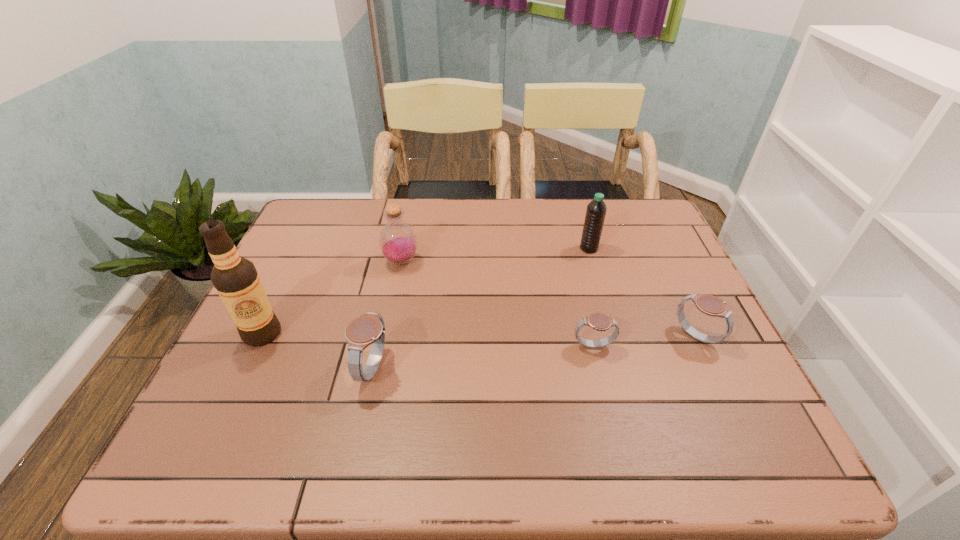
The width and height of the screenshot is (960, 540). In order to click on unoccupied area between the shortest object and the water bottle in this screenshot , I will do `click(591, 298)`.

The width and height of the screenshot is (960, 540). I want to click on vacant area that lies between the rightmost object and the water bottle, so click(x=642, y=293).

Identify the location of free point between the rightmost object and the bottle. (548, 299).

Where is `vacant space in between the tallest object and the shortest watch`? Image resolution: width=960 pixels, height=540 pixels. vacant space in between the tallest object and the shortest watch is located at coordinates (428, 340).

Where is `object that is the second nearest to the bottle`? object that is the second nearest to the bottle is located at coordinates (235, 278).

Point out which object is positioned as the fifth nearest to the second watch from left to right. Please provide its 2D coordinates. Your answer should be formatted as a tuple, i.e. [(x, y)], where the tuple contains the x and y coordinates of a point satisfying the conditions above.

[(235, 278)]

Where is `watch identified as the third closest to the bottle`? The height and width of the screenshot is (540, 960). watch identified as the third closest to the bottle is located at coordinates (711, 305).

Identify which watch is the second closest to the alcohol. Please provide its 2D coordinates. Your answer should be formatted as a tuple, i.e. [(x, y)], where the tuple contains the x and y coordinates of a point satisfying the conditions above.

[(598, 321)]

Identify the location of vacant space that satisfies the following two spatial constraints: 1. on the front side of the shortest watch; 2. on the left side of the bottle. This screenshot has height=540, width=960. coord(384,346).

The image size is (960, 540). I want to click on vacant area that satisfies the following two spatial constraints: 1. on the front side of the bottle; 2. on the left side of the second watch from left to right, so click(x=384, y=346).